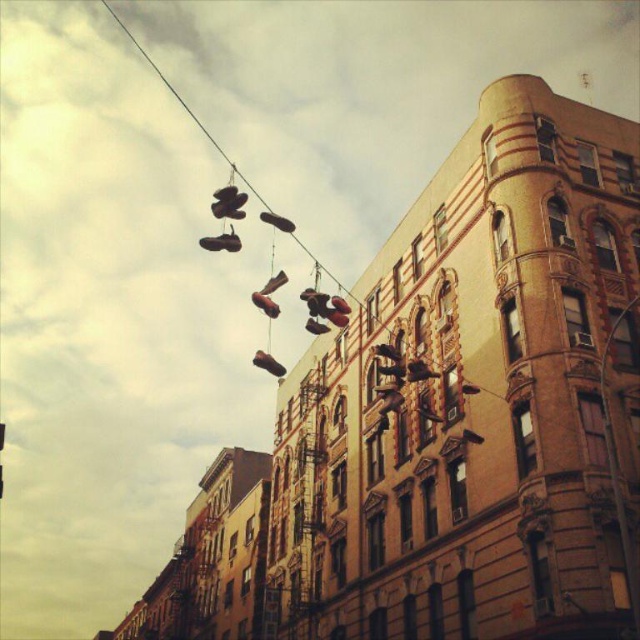
Question: Which point is closer to the camera?

Choices:
 (A) (278, 364)
 (B) (260, 305)
 (C) (232, 250)
 (D) (262, 292)

Answer: (C)

Question: Among these points, which one is farthest from the camera?

Choices:
 (A) (291, 225)
 (B) (284, 273)
 (C) (264, 310)

Answer: (B)

Question: Can you confirm if matte brown shoe at upper center is smaller than shiny brown shoe at center?

Choices:
 (A) no
 (B) yes

Answer: (A)

Question: Is shiny brown shoe at center closer to camera compared to leather shoe at center?

Choices:
 (A) yes
 (B) no

Answer: (B)

Question: Which point is closer to the camera?

Choices:
 (A) (209, 237)
 (B) (268, 292)

Answer: (B)

Question: Where is matte brown shoe at center located in relation to leather shoe at center in the image?

Choices:
 (A) right
 (B) left

Answer: (B)